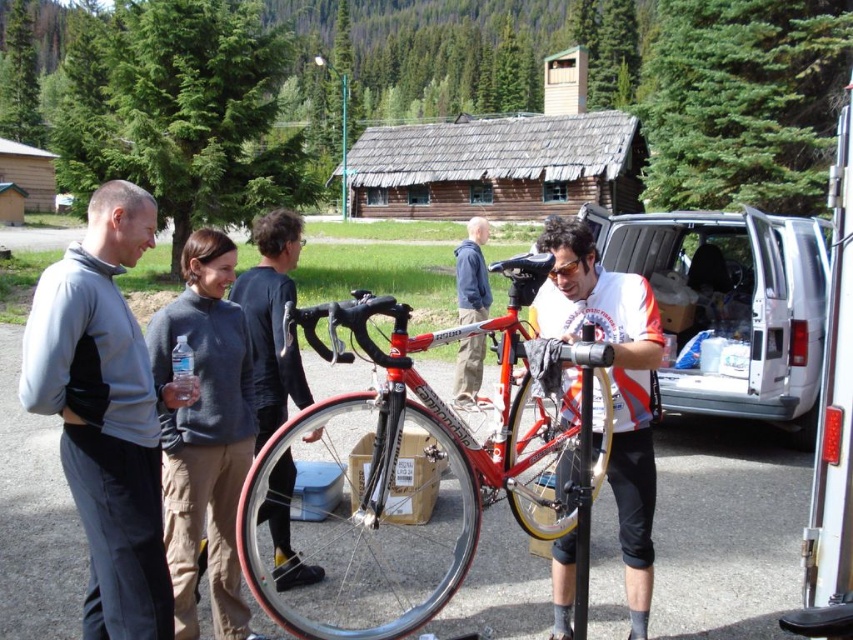
Question: Where is shiny red bike at center located in relation to clear plastic bottle at center in the image?

Choices:
 (A) left
 (B) right

Answer: (B)

Question: Estimate the real-world distances between objects in this image. Which object is closer to the clear plastic bottle at center?

Choices:
 (A) shiny red bike at center
 (B) white plastic van at right
 (C) yellow rubber tire at center
 (D) black rubber tire at center

Answer: (A)

Question: Does white plastic van at right appear over black rubber tire at center?

Choices:
 (A) no
 (B) yes

Answer: (B)

Question: Among these objects, which one is nearest to the camera?

Choices:
 (A) dark blue sweater at center
 (B) yellow rubber tire at center
 (C) shiny red bike at center
 (D) clear plastic bottle at center

Answer: (C)

Question: Based on their relative distances, which object is farther from the yellow rubber tire at center?

Choices:
 (A) shiny red bike at center
 (B) gray fleece jacket at left
 (C) matte black bicycle at center
 (D) white plastic van at right

Answer: (D)

Question: Does black rubber tire at center appear under shiny silver helmet at center?

Choices:
 (A) no
 (B) yes

Answer: (B)